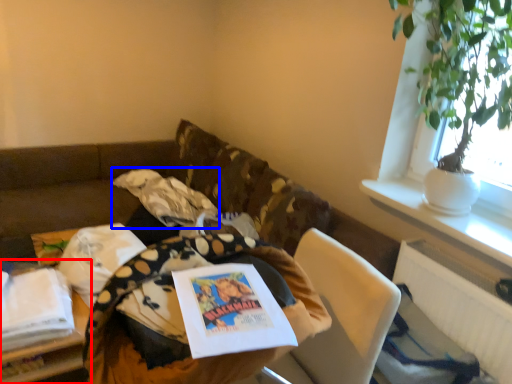
Question: Among these objects, which one is farthest to the camera, table (highlighted by a red box) or material (highlighted by a blue box)?

Choices:
 (A) table
 (B) material

Answer: (B)